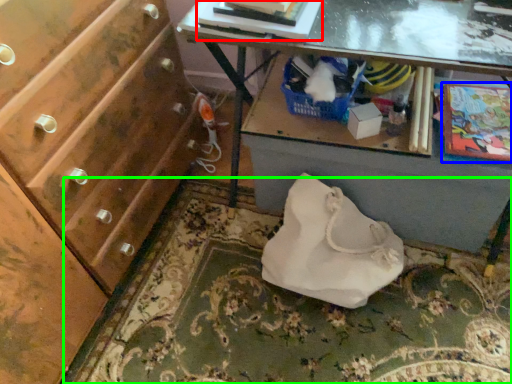
Question: Which object is positioned farthest from book (highlighted by a red box)? Select from comic book (highlighted by a blue box) and mat (highlighted by a green box).

Choices:
 (A) comic book
 (B) mat

Answer: (B)